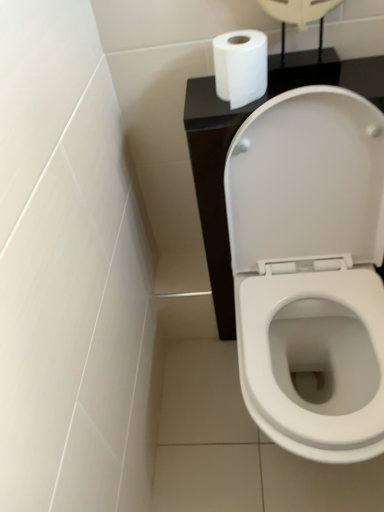
Question: Is white matte toilet paper at upper right at the back of white glossy toilet at center?

Choices:
 (A) yes
 (B) no

Answer: (B)

Question: Is white glossy toilet at center outside of white matte toilet paper at upper right?

Choices:
 (A) no
 (B) yes

Answer: (B)

Question: From the image's perspective, is white glossy toilet at center on white matte toilet paper at upper right?

Choices:
 (A) yes
 (B) no

Answer: (B)

Question: Is white glossy toilet at center at the right side of white matte toilet paper at upper right?

Choices:
 (A) no
 (B) yes

Answer: (B)

Question: Is white glossy toilet at center positioned behind white matte toilet paper at upper right?

Choices:
 (A) no
 (B) yes

Answer: (A)

Question: Can you confirm if white glossy toilet at center is wider than white matte toilet paper at upper right?

Choices:
 (A) yes
 (B) no

Answer: (A)

Question: Is white matte toilet paper at upper right bigger than white glossy toilet at center?

Choices:
 (A) yes
 (B) no

Answer: (B)

Question: Is white matte toilet paper at upper right next to white glossy toilet at center?

Choices:
 (A) no
 (B) yes

Answer: (A)

Question: Is white matte toilet paper at upper right located outside white glossy toilet at center?

Choices:
 (A) yes
 (B) no

Answer: (A)

Question: Is white matte toilet paper at upper right in front of white glossy toilet at center?

Choices:
 (A) no
 (B) yes

Answer: (A)

Question: Considering the relative sizes of white matte toilet paper at upper right and white glossy toilet at center in the image provided, is white matte toilet paper at upper right taller than white glossy toilet at center?

Choices:
 (A) yes
 (B) no

Answer: (B)

Question: Is white matte toilet paper at upper right at the right side of white glossy toilet at center?

Choices:
 (A) no
 (B) yes

Answer: (A)

Question: Considering the positions of white matte toilet paper at upper right and white glossy toilet at center in the image, is white matte toilet paper at upper right wider or thinner than white glossy toilet at center?

Choices:
 (A) wide
 (B) thin

Answer: (B)